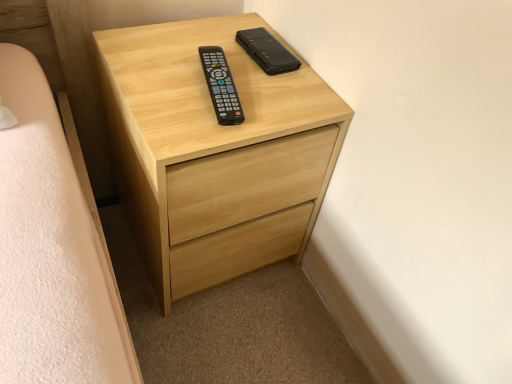
Identify the location of empty space that is in between black plastic remote at center, which is counted as the 1th control, starting from the front, and black leather phone case at upper center, positioned as the first control in back-to-front order. pos(256,86).